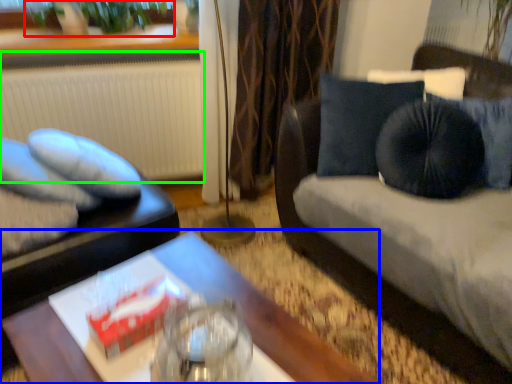
Question: Based on their relative distances, which object is farther from plant (highlighted by a red box)? Choose from table (highlighted by a blue box) and radiator (highlighted by a green box).

Choices:
 (A) table
 (B) radiator

Answer: (A)